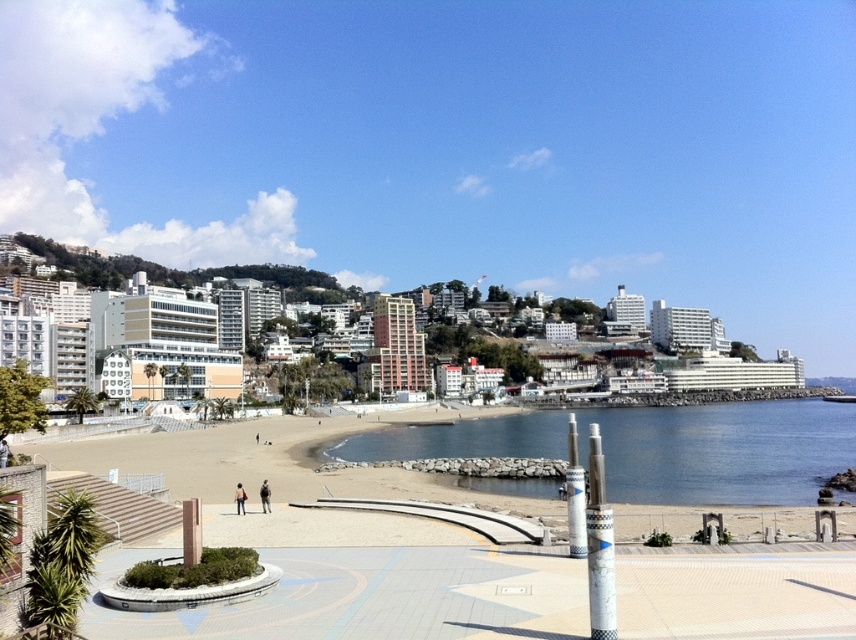
Does beige sand at center have a lesser height compared to clear blue water at center?

Yes, beige sand at center is shorter than clear blue water at center.

Between point (334, 488) and point (539, 449), which one is positioned in front?

Positioned in front is point (334, 488).

You are a GUI agent. You are given a task and a screenshot of the screen. Output one action in this format:
    pyautogui.click(x=<x>, y=<y>)
    Task: Click on the beige sand at center
    The image size is (856, 640).
    Given the screenshot: What is the action you would take?
    point(321,458)

Who is positioned more to the right, beige sand at center or green grassy hillside at upper center?

From the viewer's perspective, beige sand at center appears more on the right side.

Between point (503, 504) and point (183, 276), which one is positioned in front?

Point (503, 504) is more forward.

The image size is (856, 640). In order to click on beige sand at center in this screenshot , I will do `click(321, 458)`.

Who is more forward, (710, 496) or (64, 268)?

Point (710, 496) is in front.

Does point (749, 410) come farther from viewer compared to point (158, 268)?

No, (749, 410) is in front of (158, 268).

The height and width of the screenshot is (640, 856). I want to click on clear blue water at center, so click(x=722, y=451).